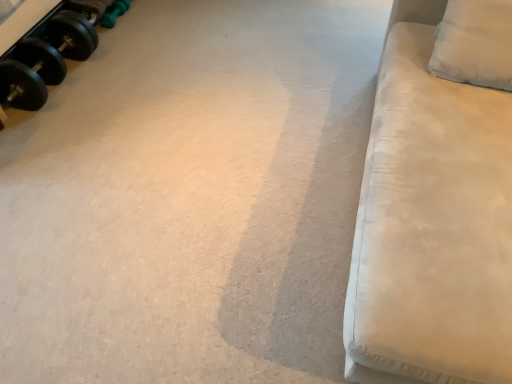
Question: Is white fabric couch at right in front of black rubber dumbbell at upper left, marked as the 2th dumbbell in a back-to-front arrangement?

Choices:
 (A) yes
 (B) no

Answer: (A)

Question: From the image's perspective, is white fabric couch at right on top of black rubber dumbbell at upper left, the 1th dumbbell in the front-to-back sequence?

Choices:
 (A) no
 (B) yes

Answer: (A)

Question: Considering the relative positions of white fabric couch at right and black rubber dumbbell at upper left, the 1th dumbbell in the front-to-back sequence, in the image provided, is white fabric couch at right to the left of black rubber dumbbell at upper left, the 1th dumbbell in the front-to-back sequence, from the viewer's perspective?

Choices:
 (A) yes
 (B) no

Answer: (B)

Question: Does white fabric couch at right have a smaller size compared to black rubber dumbbell at upper left, the 1th dumbbell in the front-to-back sequence?

Choices:
 (A) no
 (B) yes

Answer: (A)

Question: Considering the relative sizes of white fabric couch at right and black rubber dumbbell at upper left, the 1th dumbbell in the front-to-back sequence, in the image provided, is white fabric couch at right shorter than black rubber dumbbell at upper left, the 1th dumbbell in the front-to-back sequence,?

Choices:
 (A) no
 (B) yes

Answer: (A)

Question: Is black rubber dumbbell at upper left, marked as the 2th dumbbell in a back-to-front arrangement, bigger or smaller than white fabric pillow at upper right?

Choices:
 (A) big
 (B) small

Answer: (B)

Question: Relative to white fabric pillow at upper right, is black rubber dumbbell at upper left, marked as the 2th dumbbell in a back-to-front arrangement, in front or behind?

Choices:
 (A) front
 (B) behind

Answer: (B)

Question: Do you think black rubber dumbbell at upper left, the 1th dumbbell in the front-to-back sequence, is within white fabric pillow at upper right, or outside of it?

Choices:
 (A) inside
 (B) outside

Answer: (B)

Question: Is black rubber dumbbell at upper left, the 1th dumbbell in the front-to-back sequence, to the left or to the right of white fabric pillow at upper right in the image?

Choices:
 (A) right
 (B) left

Answer: (B)

Question: Is white fabric couch at right wider or thinner than black rubber dumbbell at upper left, the 1th dumbbell in the front-to-back sequence?

Choices:
 (A) thin
 (B) wide

Answer: (B)

Question: In terms of size, does white fabric couch at right appear bigger or smaller than black rubber dumbbell at upper left, the 1th dumbbell in the front-to-back sequence?

Choices:
 (A) small
 (B) big

Answer: (B)

Question: From a real-world perspective, is white fabric couch at right physically located above or below black rubber dumbbell at upper left, marked as the 2th dumbbell in a back-to-front arrangement?

Choices:
 (A) below
 (B) above

Answer: (B)

Question: Is white fabric couch at right inside or outside of black rubber dumbbell at upper left, the 1th dumbbell in the front-to-back sequence?

Choices:
 (A) outside
 (B) inside

Answer: (A)

Question: From a real-world perspective, relative to white fabric couch at right, is white fabric pillow at upper right vertically above or below?

Choices:
 (A) below
 (B) above

Answer: (B)

Question: From their relative heights in the image, would you say white fabric pillow at upper right is taller or shorter than white fabric couch at right?

Choices:
 (A) tall
 (B) short

Answer: (B)